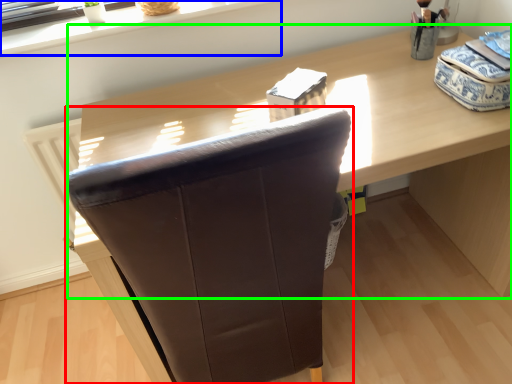
Question: Which object is the farthest from chair (highlighted by a red box)? Choose among these: window sill (highlighted by a blue box) or computer desk (highlighted by a green box).

Choices:
 (A) window sill
 (B) computer desk

Answer: (A)